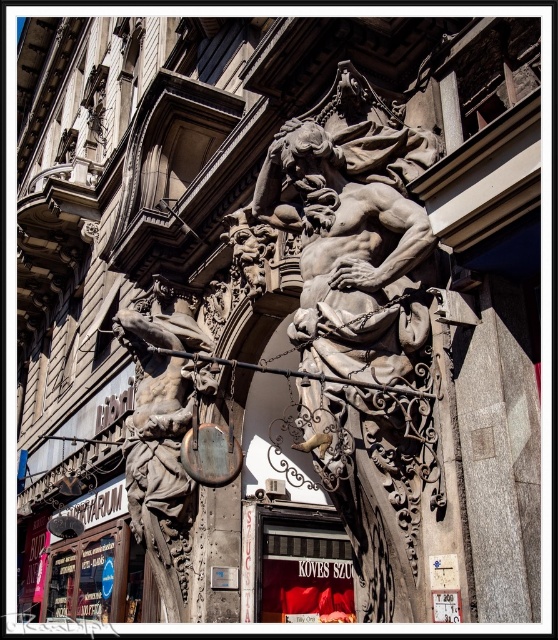
Question: Which point appears farthest from the camera in this image?

Choices:
 (A) (382, 593)
 (B) (138, 474)

Answer: (B)

Question: Among these points, which one is nearest to the camera?

Choices:
 (A) (177, 531)
 (B) (357, 282)

Answer: (B)

Question: Can you confirm if gray stone sculpture at center is smaller than polished bronze statue at left?

Choices:
 (A) no
 (B) yes

Answer: (A)

Question: Does gray stone sculpture at center appear on the right side of polished bronze statue at left?

Choices:
 (A) yes
 (B) no

Answer: (A)

Question: From the image, what is the correct spatial relationship of gray stone sculpture at center in relation to polished bronze statue at left?

Choices:
 (A) above
 (B) below

Answer: (A)

Question: Which of the following is the farthest from the observer?

Choices:
 (A) polished bronze statue at left
 (B) gray stone sculpture at center

Answer: (A)